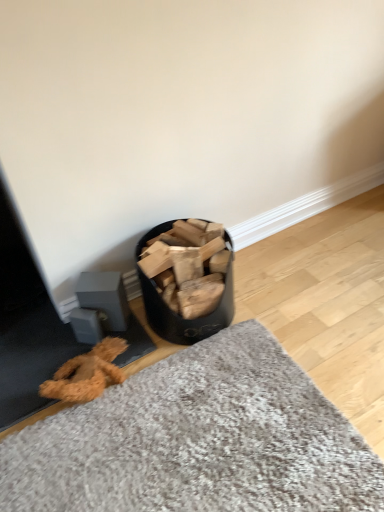
Where is `spots to the right of black matte wood at center`? spots to the right of black matte wood at center is located at coordinates (276, 298).